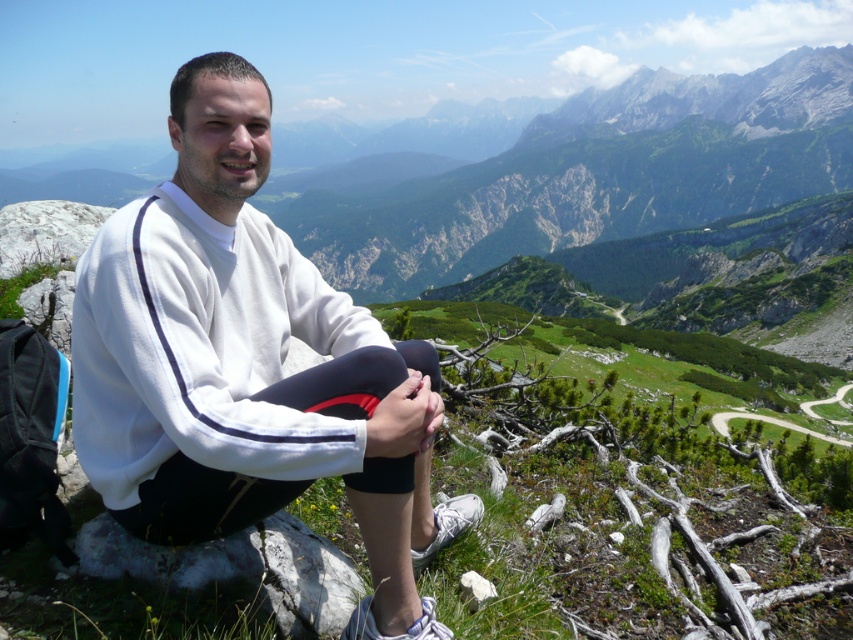
You are a hiker who wants to place a white fleece at center on top of the white rough rock at lower center. Based on the scene, can you do this successfully?

The white fleece at center is already located above the white rough rock at lower center, so you can successfully place it there.

You are standing at the base of the mountain looking up at the rocky outcrop where the person is sitting. There are two points marked on the outcrop. Which of the two points, point (x=357, y=621) or point (x=148, y=557), is closer to you?

Point (x=357, y=621) is closer to the viewer than point (x=148, y=557).

You are a hiker who has just arrived at the rocky outcrop. You need to place your white fleece at center and your white rough rock at lower center on the ground. Given the space between them, can you fit a 1.5 meter long hiking pole between them?

The distance between the white fleece at center and the white rough rock at lower center is 1.48 meters. Since the hiking pole is 1.5 meters long, it cannot fit between them as the space is slightly shorter than the pole.